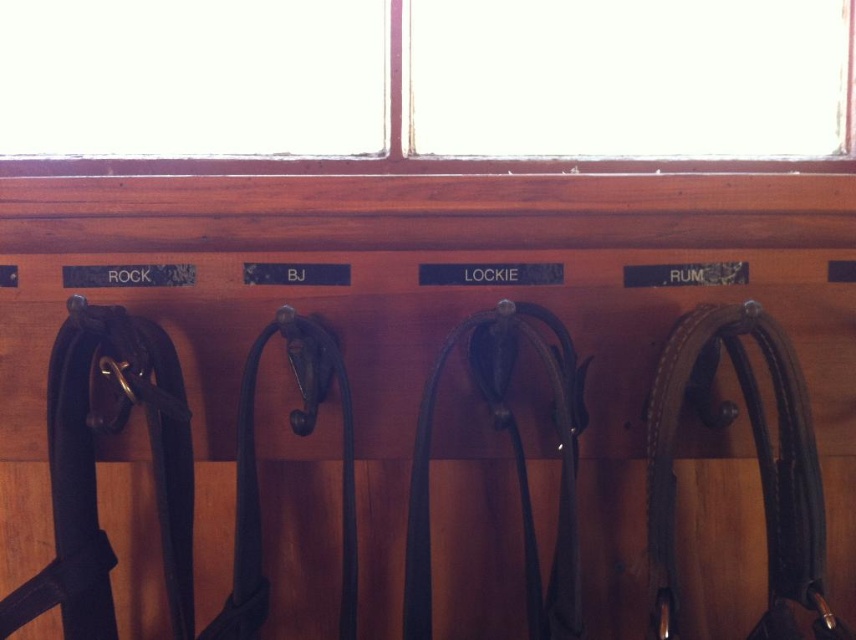
You are organizing a backpacking trip and need to choose between the leather strap at right and the black leather strap at center. Based on their sizes, which one is more suitable for carrying heavier loads?

The leather strap at right is bigger than the black leather strap at center, so it is more suitable for carrying heavier loads.

In the scene shown: You are a person who is 1.7 meters tall and standing in front of the wooden wall with hooks. You want to reach the black leather strap at center. Can you comfortably reach it without needing a stool?

The black leather strap at center and viewer are 1.05 meters apart. Since the average comfortable reaching height for a person of 1.7 meters is about 2.2 meters, and the distance here is 1.05 meters, you can comfortably reach it without needing a stool.